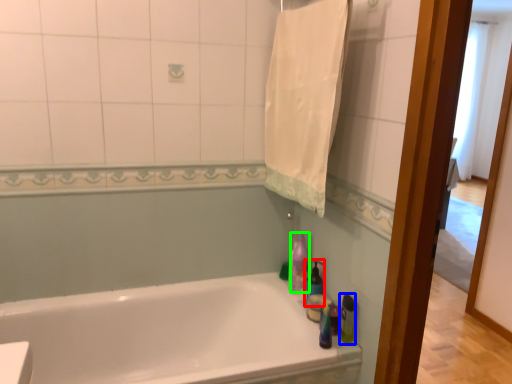
Question: Estimate the real-world distances between objects in this image. Which object is closer to cleaning product (highlighted by a red box), cleaning product (highlighted by a blue box) or cleaning product (highlighted by a green box)?

Choices:
 (A) cleaning product
 (B) cleaning product

Answer: (B)